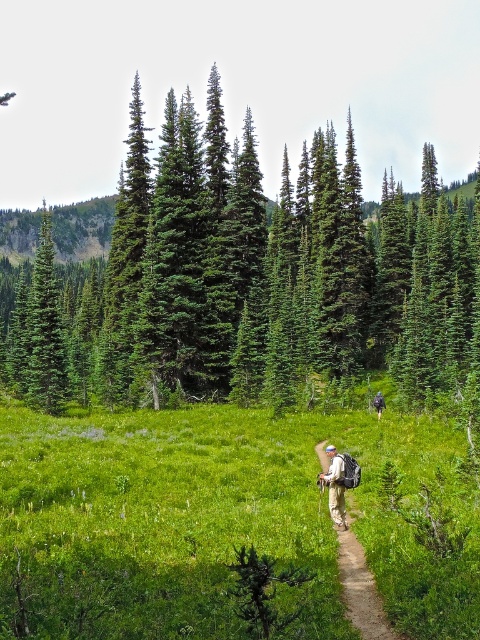
Question: Which point is closer to the camera taking this photo?

Choices:
 (A) (380, 408)
 (B) (359, 580)
 (C) (151, 490)

Answer: (B)

Question: Does green evergreen tree at center appear on the right side of camouflage backpack at center?

Choices:
 (A) yes
 (B) no

Answer: (B)

Question: Can you confirm if green evergreen tree at center is positioned below tan fabric backpack at center?

Choices:
 (A) no
 (B) yes

Answer: (A)

Question: Which object is positioned farthest from the camouflage backpack at center?

Choices:
 (A) green evergreen tree at center
 (B) khaki cotton pants at center
 (C) green grassy field at center
 (D) tan fabric backpack at center

Answer: (A)

Question: Which is farther from the green evergreen tree at center?

Choices:
 (A) camouflage backpack at center
 (B) khaki cotton pants at center
 (C) green grassy field at center
 (D) tan fabric backpack at center

Answer: (D)

Question: Can you confirm if green evergreen tree at center is bigger than tan fabric backpack at center?

Choices:
 (A) no
 (B) yes

Answer: (B)